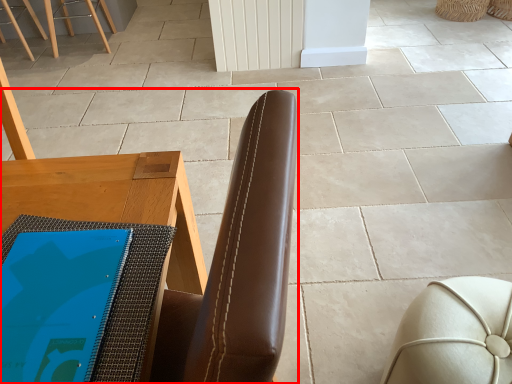
Question: From the image's perspective, what is the correct spatial relationship of chair (annotated by the red box) in relation to furniture?

Choices:
 (A) above
 (B) below

Answer: (A)